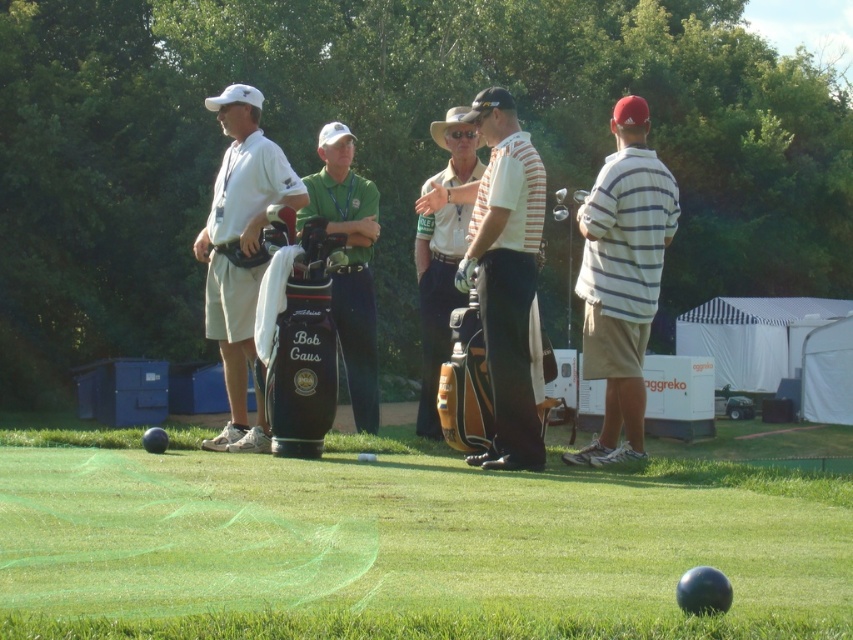
Question: Estimate the real-world distances between objects in this image. Which object is farther from the green fabric golf bag at center?

Choices:
 (A) striped cotton shirt at right
 (B) striped cotton shirt at center

Answer: (A)

Question: Among these objects, which one is nearest to the camera?

Choices:
 (A) leather golf bag at center
 (B) green fabric golf bag at center

Answer: (A)

Question: Which object is closer to the camera taking this photo?

Choices:
 (A) striped cotton shirt at center
 (B) leather golf bag at center

Answer: (A)

Question: Is white matte golf bag at left thinner than green fabric golf bag at center?

Choices:
 (A) no
 (B) yes

Answer: (A)

Question: Can you confirm if smooth green turf at lower center is positioned to the left of white matte golf bag at left?

Choices:
 (A) no
 (B) yes

Answer: (A)

Question: Is white matte golf bag at left wider than green fabric golf bag at center?

Choices:
 (A) no
 (B) yes

Answer: (B)